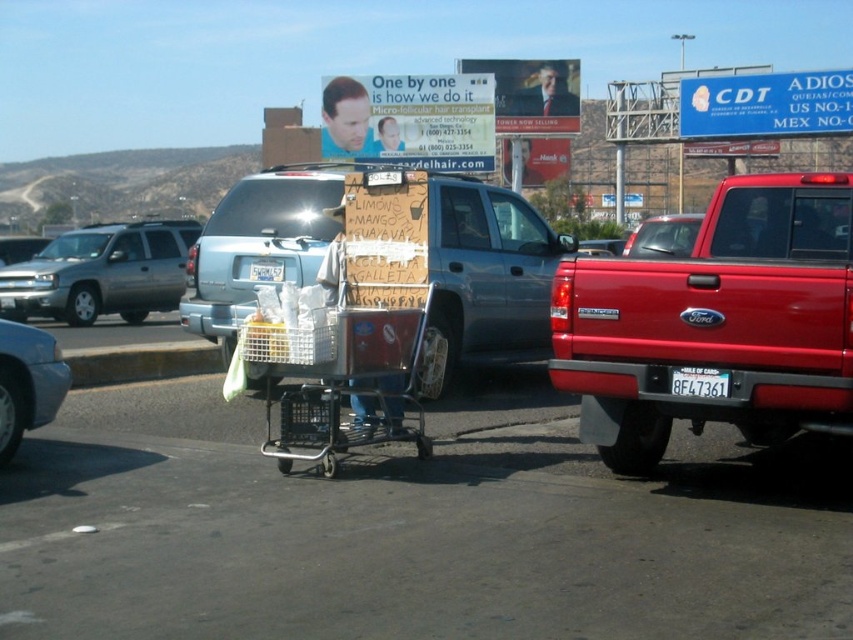
Who is lower down, shiny red pickup truck at right or metallic silver sedan at lower left?

metallic silver sedan at lower left

Between point (614, 275) and point (26, 412), which one is positioned behind?

Positioned behind is point (26, 412).

I want to click on shiny red pickup truck at right, so click(x=717, y=323).

The image size is (853, 640). Find the location of `shiny red pickup truck at right`. shiny red pickup truck at right is located at coordinates (717, 323).

Is silver metallic suv at left behind black plastic license plate at lower center?

Yes, silver metallic suv at left is further from the viewer.

What are the coordinates of `silver metallic suv at left` in the screenshot? It's located at (102, 273).

Does point (283, 186) lie in front of point (749, 113)?

Yes, it is in front of point (749, 113).

Consider the image. How much distance is there between metallic silver cart at center and blue plastic sign at upper right?

metallic silver cart at center and blue plastic sign at upper right are 25.96 meters apart.

Find the location of a particular element. The image size is (853, 640). metallic silver cart at center is located at coordinates (489, 273).